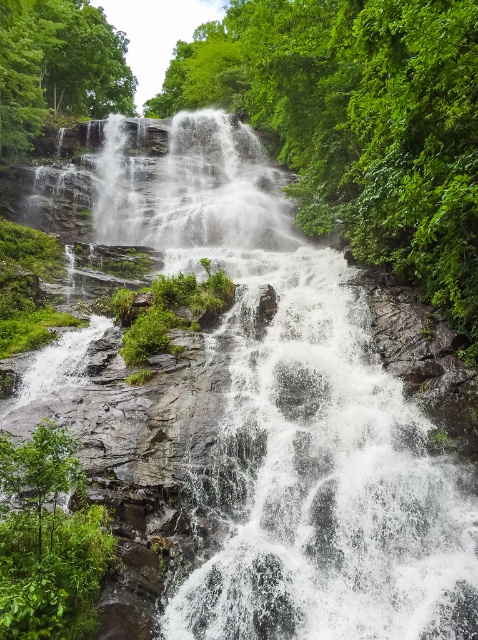
You are standing at the edge of the waterfall and notice a specific point marked at coordinates point (x=192, y=188). What is present at this location?

The white frothy water at center is located at point (x=192, y=188).

You are a drone operator trying to capture the waterfall. The drone has a camera that can only focus on objects within a 0.1 radius around the point 0.3, 0.4. Will the white frothy water at center be in focus?

The white frothy water at center is located at point (192, 188), which is within the 0.1 radius of the point (191, 192). Therefore, the white frothy water at center will be in focus.

You are standing at the base of the waterfall and notice two points marked on the cliff face. The first point is at coordinates point [243,209] and the second is at point [116,68]. Which point is closer to you?

Point [243,209] is in front of point [116,68], so it is closer to you.